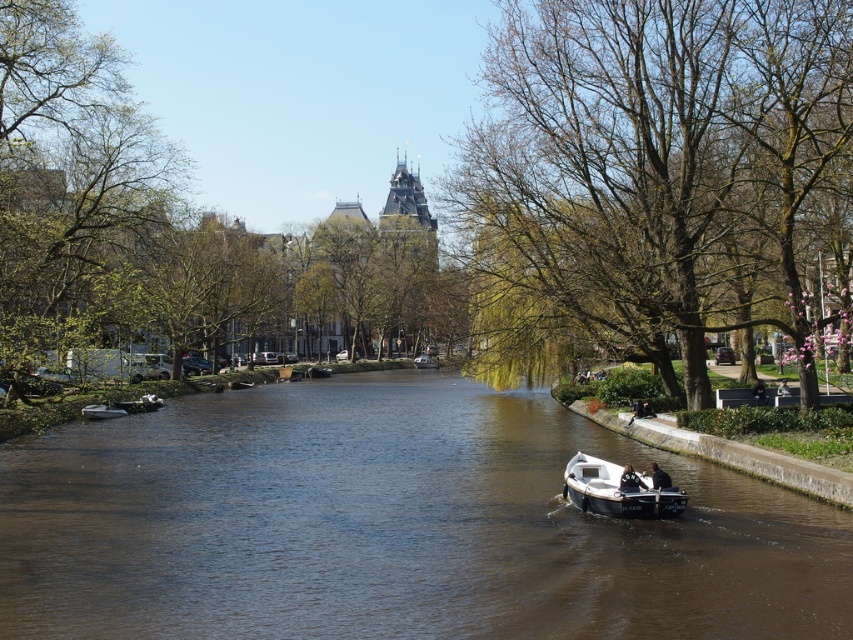
Question: Which of the following is the closest to the observer?

Choices:
 (A) (683, 38)
 (B) (431, 365)
 (C) (234, 394)
 (D) (601, 506)

Answer: (D)

Question: Is green leafy tree at right thinner than metallic silver boat at left?

Choices:
 (A) no
 (B) yes

Answer: (A)

Question: Does green leafy tree at right have a lesser width compared to white matte boat at center?

Choices:
 (A) yes
 (B) no

Answer: (B)

Question: Which object appears closest to the camera in this image?

Choices:
 (A) white glossy boat at center
 (B) brown smooth water at center
 (C) white matte boat at center

Answer: (B)

Question: Observing the image, what is the correct spatial positioning of green leafy tree at right in reference to metallic silver boat at left?

Choices:
 (A) left
 (B) right

Answer: (B)

Question: Among these points, which one is nearest to the camera?

Choices:
 (A) (759, 282)
 (B) (630, 557)
 (C) (100, 404)
 (D) (631, 484)

Answer: (B)